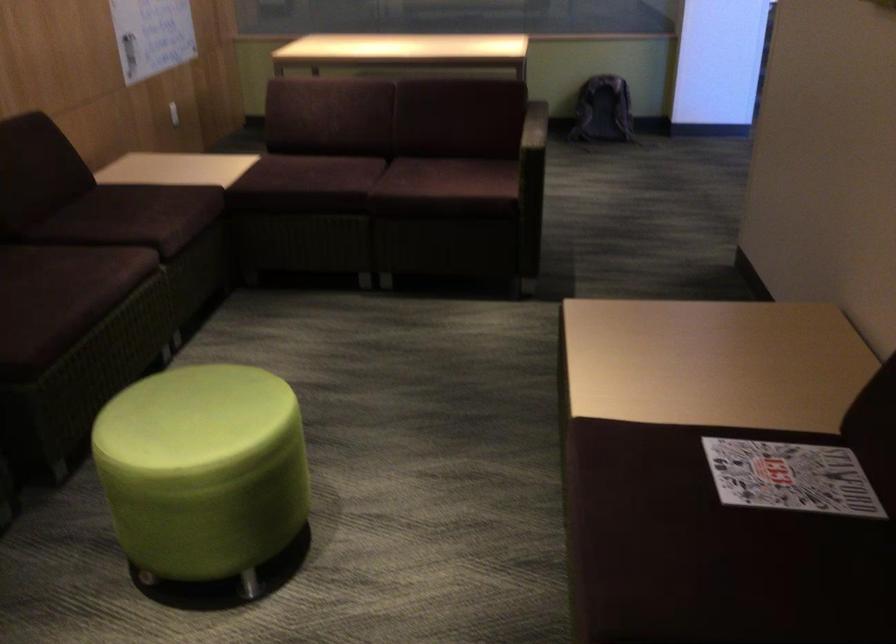
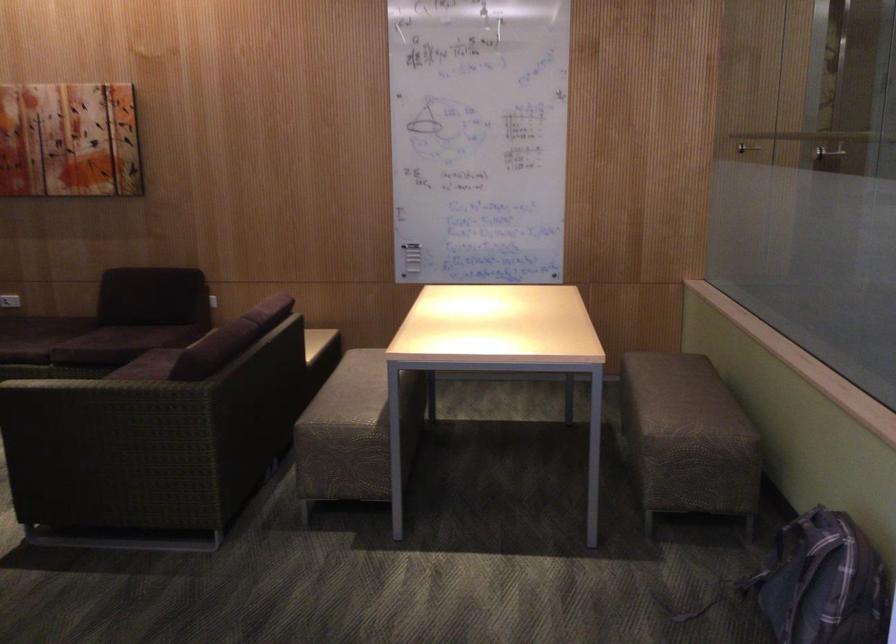
The point at [642,111] is marked in the first image. Where is the corresponding point in the second image?

(823, 583)